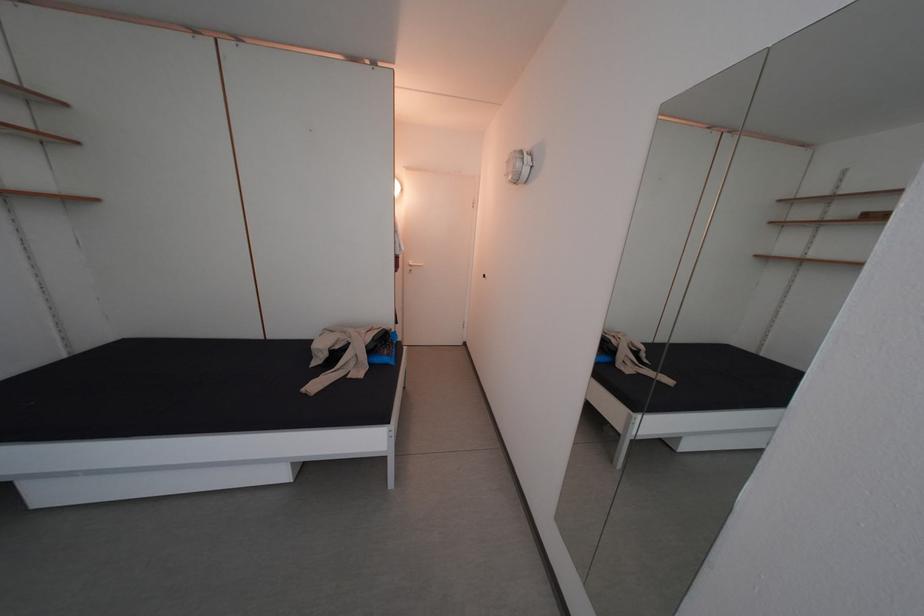
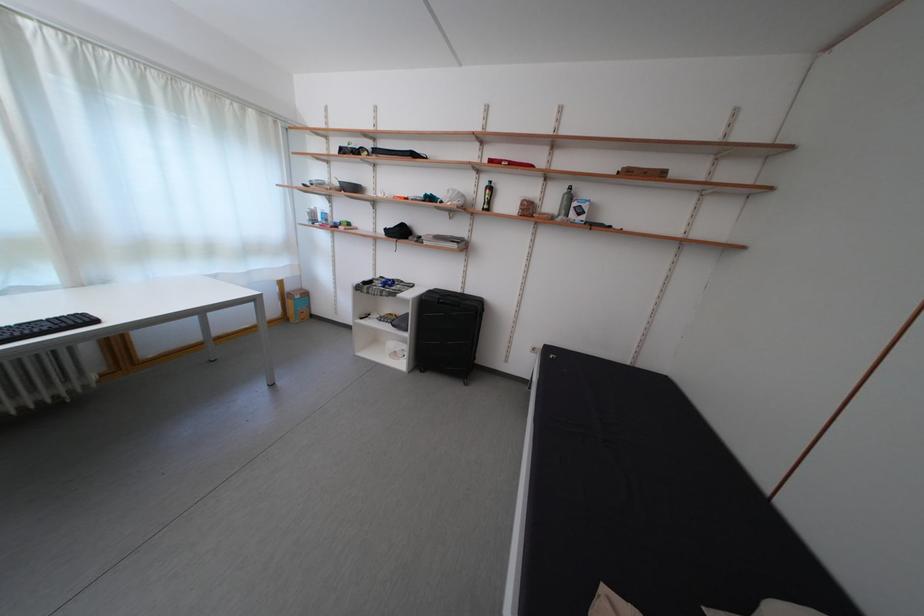
The first image is from the beginning of the video and the second image is from the end. How did the camera likely rotate when shooting the video?

The camera rotated toward left-down.